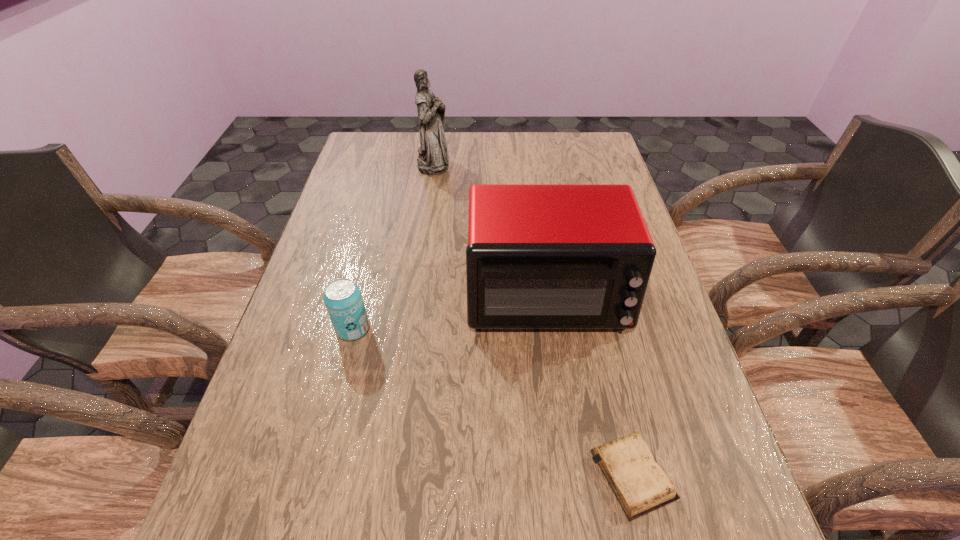
This screenshot has width=960, height=540. What are the coordinates of `figurine` in the screenshot? It's located at (432, 159).

Where is `the farthest object`? Image resolution: width=960 pixels, height=540 pixels. the farthest object is located at coordinates (432, 159).

What are the coordinates of `toaster oven` in the screenshot? It's located at (540, 256).

Where is `beer can`? Image resolution: width=960 pixels, height=540 pixels. beer can is located at coordinates (342, 297).

Where is `the leftmost object`? the leftmost object is located at coordinates (342, 297).

You are a GUI agent. You are given a task and a screenshot of the screen. Output one action in this format:
    pyautogui.click(x=<x>, y=<y>)
    Task: Click on the diary
    This screenshot has height=540, width=960.
    Given the screenshot: What is the action you would take?
    pyautogui.click(x=640, y=484)

The image size is (960, 540). In order to click on the nearest object in this screenshot , I will do `click(640, 484)`.

Find the location of a particular element. The width and height of the screenshot is (960, 540). free space located 0.150m on the front-facing side of the figurine is located at coordinates [x=494, y=163].

You are a GUI agent. You are given a task and a screenshot of the screen. Output one action in this format:
    pyautogui.click(x=<x>, y=<y>)
    Task: Click on the free location located 0.140m on the front-facing side of the third shortest object
    The width and height of the screenshot is (960, 540).
    Given the screenshot: What is the action you would take?
    pyautogui.click(x=561, y=402)

Find the location of `free region located on the front of the beer can`. free region located on the front of the beer can is located at coordinates (338, 388).